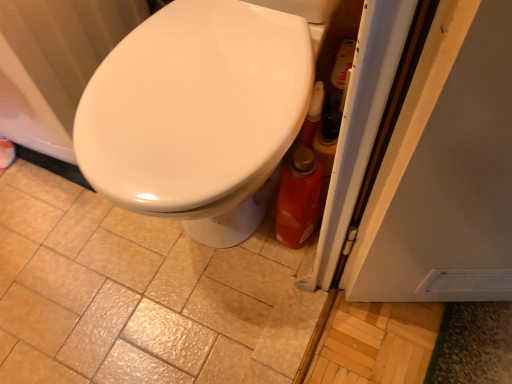
Question: Are matte ceramic tile at center and white glossy radiator at upper left far apart?

Choices:
 (A) no
 (B) yes

Answer: (A)

Question: Does matte ceramic tile at center have a lesser height compared to white glossy radiator at upper left?

Choices:
 (A) yes
 (B) no

Answer: (A)

Question: From a real-world perspective, is matte ceramic tile at center below white glossy radiator at upper left?

Choices:
 (A) no
 (B) yes

Answer: (B)

Question: Considering the relative sizes of matte ceramic tile at center and white glossy radiator at upper left in the image provided, is matte ceramic tile at center bigger than white glossy radiator at upper left?

Choices:
 (A) yes
 (B) no

Answer: (B)

Question: Is matte ceramic tile at center not inside white glossy radiator at upper left?

Choices:
 (A) yes
 (B) no

Answer: (A)

Question: Could you tell me if matte ceramic tile at center is facing white glossy radiator at upper left?

Choices:
 (A) no
 (B) yes

Answer: (A)

Question: Can you confirm if matte ceramic tile at center is positioned to the left of white glossy bidet at center?

Choices:
 (A) no
 (B) yes

Answer: (B)

Question: Could white glossy bidet at center be considered to be inside matte ceramic tile at center?

Choices:
 (A) yes
 (B) no

Answer: (B)

Question: Is matte ceramic tile at center looking in the opposite direction of white glossy bidet at center?

Choices:
 (A) yes
 (B) no

Answer: (B)

Question: Is matte ceramic tile at center at the right side of white glossy bidet at center?

Choices:
 (A) yes
 (B) no

Answer: (B)

Question: Considering the relative sizes of matte ceramic tile at center and white glossy bidet at center in the image provided, is matte ceramic tile at center taller than white glossy bidet at center?

Choices:
 (A) no
 (B) yes

Answer: (A)

Question: From a real-world perspective, does matte ceramic tile at center stand above white glossy bidet at center?

Choices:
 (A) yes
 (B) no

Answer: (B)

Question: Does white glossy radiator at upper left lie behind white glossy bidet at center?

Choices:
 (A) yes
 (B) no

Answer: (A)